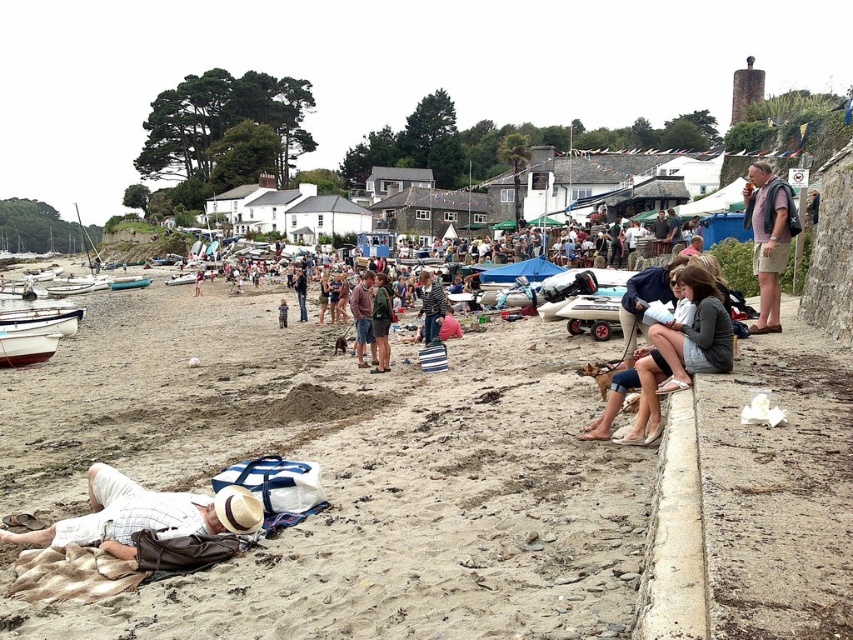
Question: Does white cotton shirt at lower left have a lesser width compared to green fabric jacket at center?

Choices:
 (A) yes
 (B) no

Answer: (B)

Question: Does light brown sand at center appear over matte gray sweater at center?

Choices:
 (A) no
 (B) yes

Answer: (A)

Question: Which is farther from the matte white tent at center?

Choices:
 (A) pink fabric backpack at upper right
 (B) matte gray sweater at center
 (C) light brown sand at center

Answer: (C)

Question: From the image, what is the correct spatial relationship of striped fabric shirt at center in relation to denim shorts at center?

Choices:
 (A) below
 (B) above

Answer: (A)

Question: Which of the following is the farthest from the observer?

Choices:
 (A) denim shorts at center
 (B) light brown sand at center
 (C) brown cotton shirt at center
 (D) matte white tent at center

Answer: (A)

Question: Which point is closer to the camera taking this photo?

Choices:
 (A) (694, 252)
 (B) (454, 352)
 (C) (305, 304)

Answer: (B)